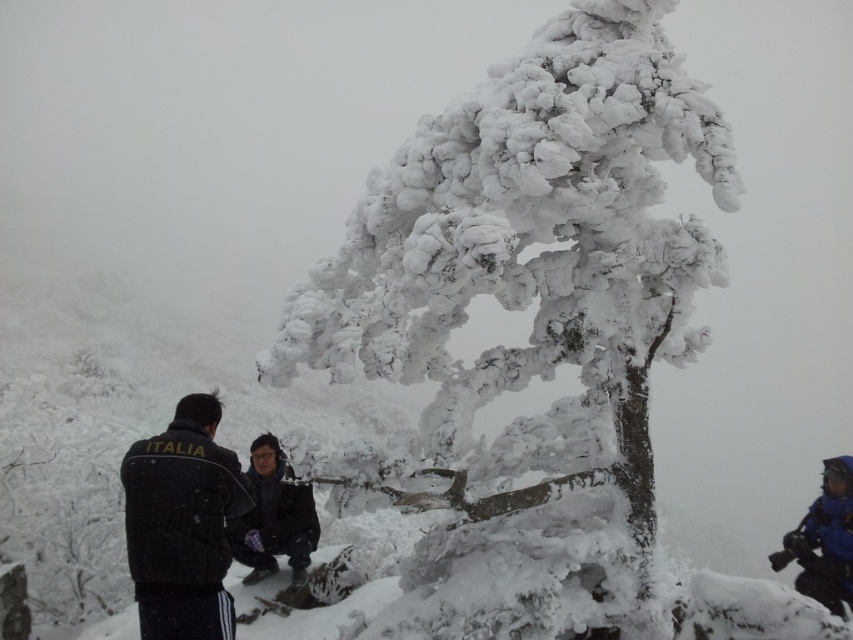
Question: Does black fabric jacket at left lie behind blue waterproof jacket at lower right?

Choices:
 (A) yes
 (B) no

Answer: (B)

Question: Does dark gray fabric jacket at center appear over blue waterproof jacket at lower right?

Choices:
 (A) yes
 (B) no

Answer: (A)

Question: Which object appears closest to the camera in this image?

Choices:
 (A) dark gray fabric jacket at center
 (B) white frosty tree at center

Answer: (B)

Question: Which point is farther to the camera?

Choices:
 (A) (170, 492)
 (B) (799, 554)
 (C) (648, 362)

Answer: (B)

Question: Which point is farther to the camera?

Choices:
 (A) (474, 451)
 (B) (302, 564)
 (C) (196, 483)
 (D) (817, 598)

Answer: (B)

Question: Does black fabric jacket at left appear over dark gray fabric jacket at center?

Choices:
 (A) yes
 (B) no

Answer: (A)